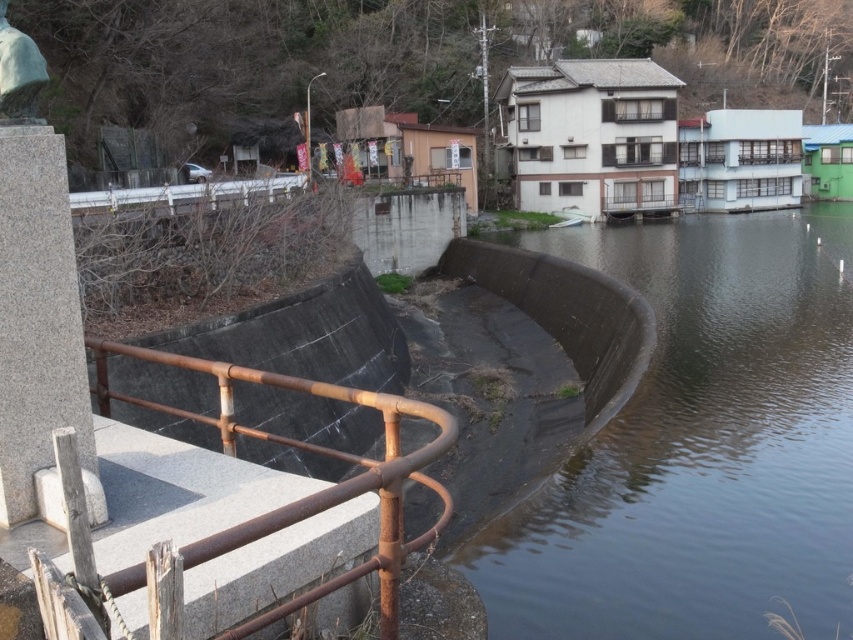
Based on the photo, can you confirm if rusty metal railing at lower left is positioned to the left of green stone statue at upper left?

Correct, you'll find rusty metal railing at lower left to the left of green stone statue at upper left.

Which is above, rusty metal railing at lower left or green stone statue at upper left?

green stone statue at upper left is higher up.

What do you see at coordinates (314, 492) in the screenshot? I see `rusty metal railing at lower left` at bounding box center [314, 492].

You are a GUI agent. You are given a task and a screenshot of the screen. Output one action in this format:
    pyautogui.click(x=<x>, y=<y>)
    Task: Click on the rusty metal railing at lower left
    This screenshot has width=853, height=640.
    Given the screenshot: What is the action you would take?
    pyautogui.click(x=314, y=492)

Consider the image. Which is below, smooth concrete river at center right or green stone statue at upper left?

smooth concrete river at center right is lower down.

Is smooth concrete river at center right smaller than green stone statue at upper left?

Actually, smooth concrete river at center right might be larger than green stone statue at upper left.

Measure the distance between smooth concrete river at center right and camera.

smooth concrete river at center right and camera are 17.27 feet apart.

Image resolution: width=853 pixels, height=640 pixels. What are the coordinates of `smooth concrete river at center right` in the screenshot? It's located at (699, 445).

Image resolution: width=853 pixels, height=640 pixels. In order to click on smooth concrete river at center right in this screenshot , I will do `click(699, 445)`.

Is smooth concrete river at center right taller than rusty metal railing at lower left?

Yes.

Which is behind, point (657, 289) or point (393, 628)?

Positioned behind is point (657, 289).

You are a GUI agent. You are given a task and a screenshot of the screen. Output one action in this format:
    pyautogui.click(x=<x>, y=<y>)
    Task: Click on the smooth concrete river at center right
    Image resolution: width=853 pixels, height=640 pixels.
    Given the screenshot: What is the action you would take?
    [x=699, y=445]